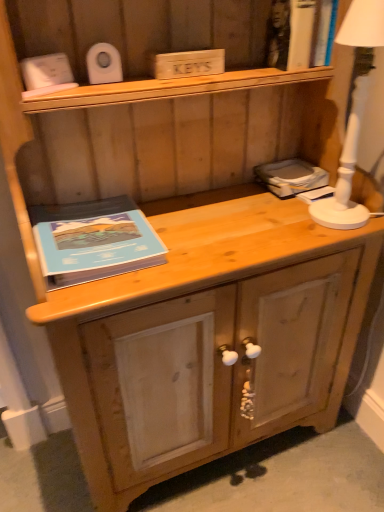
Question: Considering the relative sizes of white ceramic lamp at right and blue matte book at left in the image provided, is white ceramic lamp at right bigger than blue matte book at left?

Choices:
 (A) no
 (B) yes

Answer: (B)

Question: Can you confirm if white ceramic lamp at right is smaller than blue matte book at left?

Choices:
 (A) yes
 (B) no

Answer: (B)

Question: Does white ceramic lamp at right appear on the left side of blue matte book at left?

Choices:
 (A) yes
 (B) no

Answer: (B)

Question: Is white ceramic lamp at right completely or partially outside of blue matte book at left?

Choices:
 (A) no
 (B) yes

Answer: (B)

Question: Can you confirm if white ceramic lamp at right is taller than blue matte book at left?

Choices:
 (A) no
 (B) yes

Answer: (B)

Question: From the image's perspective, is white ceramic lamp at right over blue matte book at left?

Choices:
 (A) no
 (B) yes

Answer: (B)

Question: From a real-world perspective, is blue matte book at left physically below natural wood drawer at lower center?

Choices:
 (A) no
 (B) yes

Answer: (A)

Question: Considering the relative sizes of blue matte book at left and natural wood drawer at lower center in the image provided, is blue matte book at left taller than natural wood drawer at lower center?

Choices:
 (A) yes
 (B) no

Answer: (A)

Question: Does blue matte book at left have a smaller size compared to natural wood drawer at lower center?

Choices:
 (A) yes
 (B) no

Answer: (A)

Question: Can you confirm if blue matte book at left is wider than natural wood drawer at lower center?

Choices:
 (A) no
 (B) yes

Answer: (A)

Question: Considering the relative sizes of blue matte book at left and natural wood drawer at lower center in the image provided, is blue matte book at left thinner than natural wood drawer at lower center?

Choices:
 (A) yes
 (B) no

Answer: (A)

Question: From the image's perspective, is blue matte book at left located above natural wood drawer at lower center?

Choices:
 (A) yes
 (B) no

Answer: (A)

Question: Can you confirm if blue matte book at left is bigger than matte gray book at right?

Choices:
 (A) yes
 (B) no

Answer: (A)